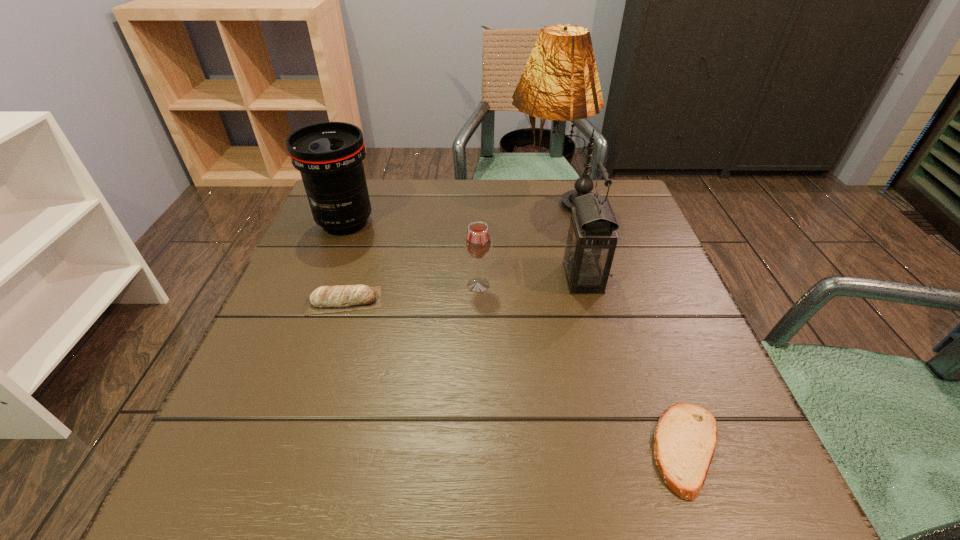
You are a GUI agent. You are given a task and a screenshot of the screen. Output one action in this format:
    pyautogui.click(x=<x>, y=<y>)
    Task: Click on the vacant space located 0.060m on the front-facing side of the lampshade
    
    Given the screenshot: What is the action you would take?
    pyautogui.click(x=485, y=200)

The height and width of the screenshot is (540, 960). What are the coordinates of `vacant space located 0.290m on the front-facing side of the lampshade` in the screenshot? It's located at (400, 200).

At what (x,y) coordinates should I click in order to perform the action: click on free space located 0.070m on the front-facing side of the lantern. Please return your answer as a coordinate pair (x, y). The height and width of the screenshot is (540, 960). Looking at the image, I should click on (531, 278).

At what (x,y) coordinates should I click in order to perform the action: click on vacant region located 0.250m on the front-facing side of the lantern. Please return your answer as a coordinate pair (x, y). The width and height of the screenshot is (960, 540). Looking at the image, I should click on (448, 278).

At what (x,y) coordinates should I click in order to perform the action: click on vacant space located on the front-facing side of the lantern. Please return your answer as a coordinate pair (x, y). The height and width of the screenshot is (540, 960). Looking at the image, I should click on (526, 278).

The image size is (960, 540). I want to click on vacant region located 0.120m on the right of the telephoto lens, so click(x=424, y=222).

In order to click on vacant area situated on the back of the third object from left to right in this screenshot , I will do `click(478, 243)`.

The image size is (960, 540). In order to click on vacant space located on the back of the left pita bread in this screenshot , I will do (x=369, y=224).

Identify the location of vacant region located 0.190m on the left of the right pita bread. (526, 449).

The height and width of the screenshot is (540, 960). I want to click on lampshade positioned at the far edge, so click(560, 81).